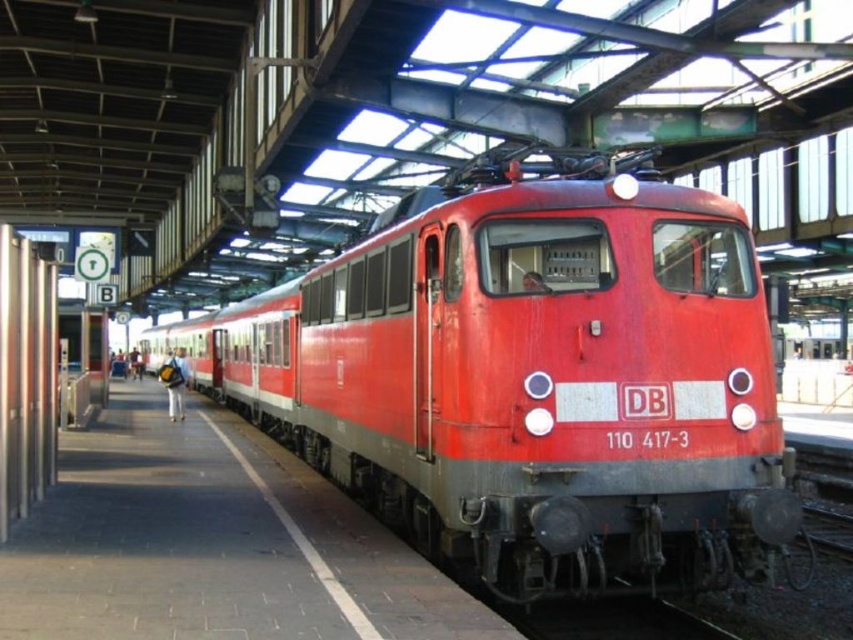
Does matte red train at center appear on the right side of smooth concrete platform at center?

Correct, you'll find matte red train at center to the right of smooth concrete platform at center.

Does matte red train at center have a greater width compared to smooth concrete platform at center?

Correct, the width of matte red train at center exceeds that of smooth concrete platform at center.

Measure the distance between matte red train at center and camera.

19.93 feet

Locate an element on the screen. matte red train at center is located at coordinates (531, 381).